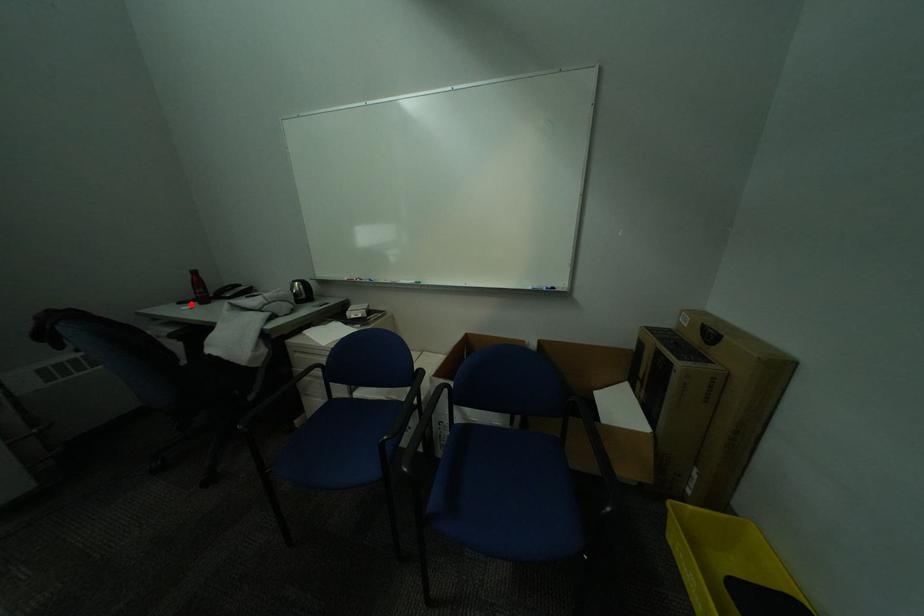
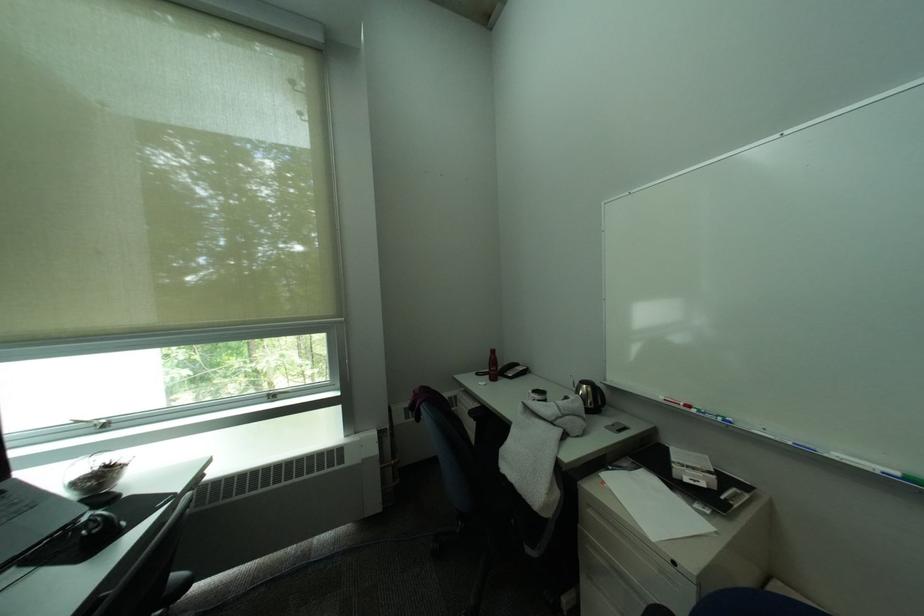
Question: I am providing you with two images of the same scene from different viewpoints. Given a red point in image1, look at the same physical point in image2. Is it:

Choices:
 (A) Closer to the viewpoint
 (B) Farther from the viewpoint

Answer: (B)